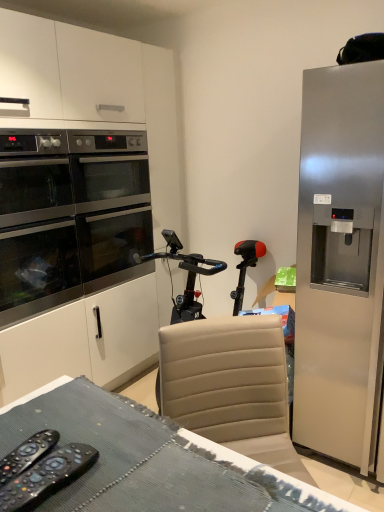
I want to click on free space to the right of black plastic remote control at lower left, the second remote control when ordered from right to left, so click(126, 459).